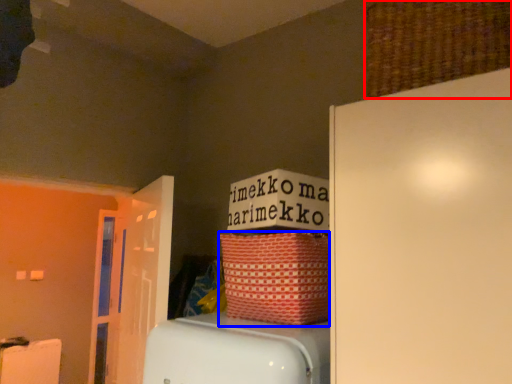
Question: Which object appears closest to the camera in this image, basket (highlighted by a red box) or basket (highlighted by a blue box)?

Choices:
 (A) basket
 (B) basket

Answer: (A)